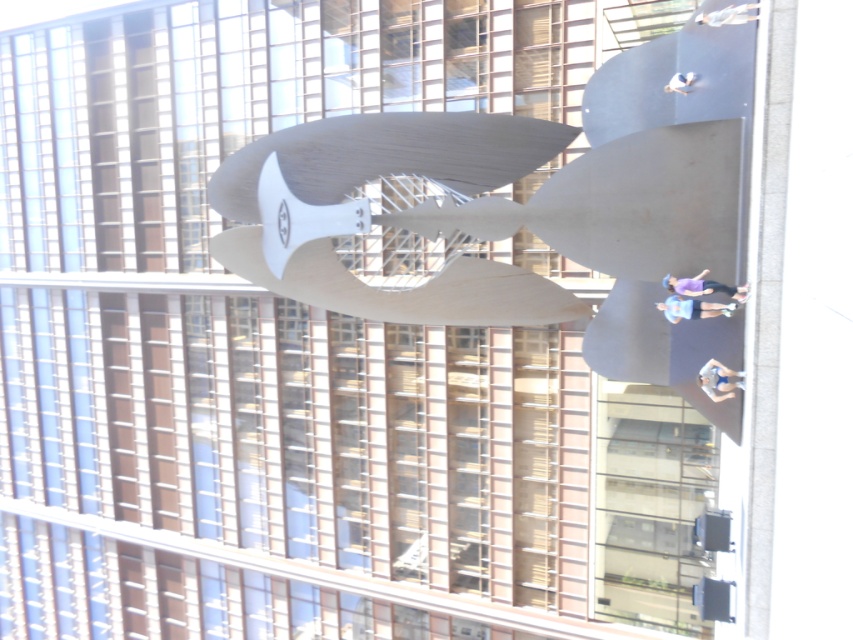
You are a photographer trying to capture the sculpture in the background with the blue fabric shorts at lower right and the purple fabric person at center in the frame. Which object should you focus on first if you want to include both in your shot?

The blue fabric shorts at lower right is smaller than the purple fabric person at center, so you should focus on the purple fabric person at center first to ensure both are in frame.

You are an artist planning to photograph two light blue fabrics in the scene. The first is the light blue fabric at center, and the second is the light blue fabric at upper center. Which fabric should you focus on if you want to capture the wider one?

The light blue fabric at center is wider than the light blue fabric at upper center, so you should focus on the light blue fabric at center to capture the wider one.